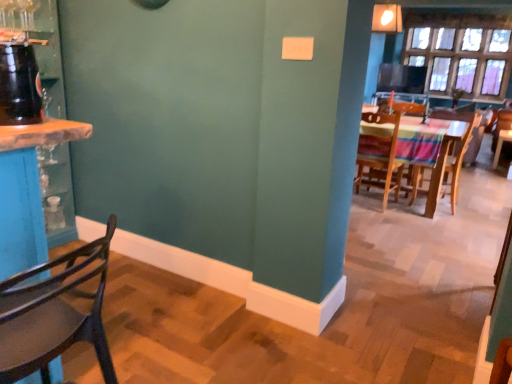
Question: Looking at the image, does wooden chair at right, positioned as the 2th chair in front-to-back order, seem bigger or smaller compared to clear glass window at upper right?

Choices:
 (A) small
 (B) big

Answer: (A)

Question: From the image's perspective, is wooden chair at right, positioned as the 2th chair in front-to-back order, positioned above or below clear glass window at upper right?

Choices:
 (A) above
 (B) below

Answer: (B)

Question: Which is nearer to the wooden chair at center, the second chair from the back?

Choices:
 (A) wooden chair at right, the first chair positioned from the right
 (B) clear glass window at upper right
 (C) wooden chair at left, which is the fourth chair from back to front
 (D) wooden chair at right, which ranks as the 3th chair in back-to-front order

Answer: (D)

Question: Which is nearer to the wooden chair at right, which is the second chair in left-to-right order?

Choices:
 (A) wooden chair at center, the third chair positioned from the left
 (B) wooden chair at left, which appears as the 1th chair when viewed from the front
 (C) clear glass window at upper right
 (D) wooden chair at right, the first chair positioned from the back

Answer: (A)